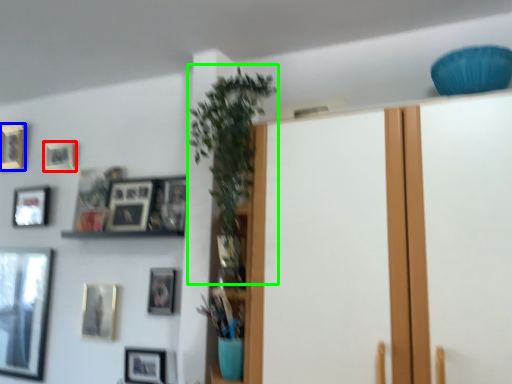
Question: Based on their relative distances, which object is nearer to picture frame (highlighted by a red box)? Choose from picture frame (highlighted by a blue box) and plant (highlighted by a green box).

Choices:
 (A) picture frame
 (B) plant

Answer: (A)